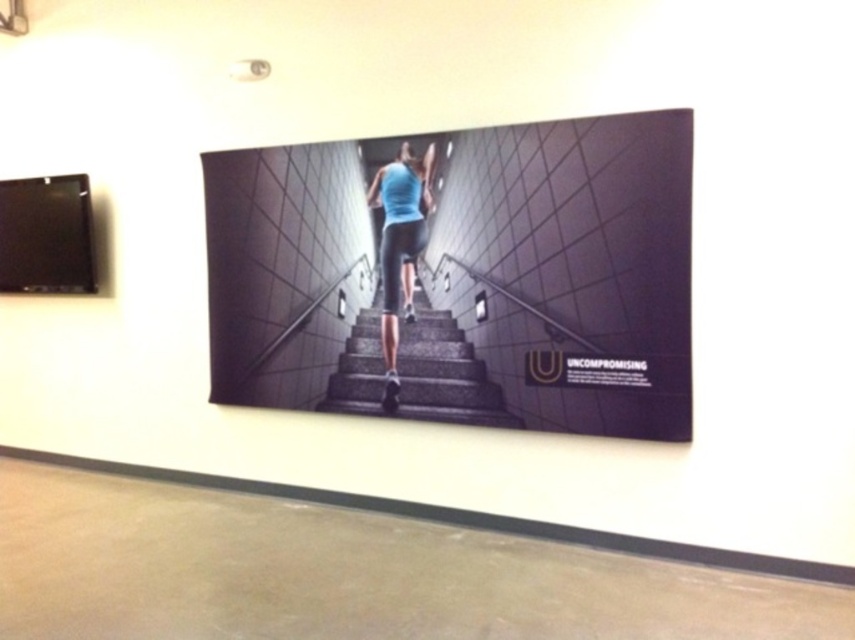
Can you confirm if gray concrete stairs at center is positioned above blue fabric leggings at center?

No.

Which is behind, point (329, 400) or point (390, 204)?

The point (329, 400) is behind.

The height and width of the screenshot is (640, 855). I want to click on gray concrete stairs at center, so click(x=416, y=371).